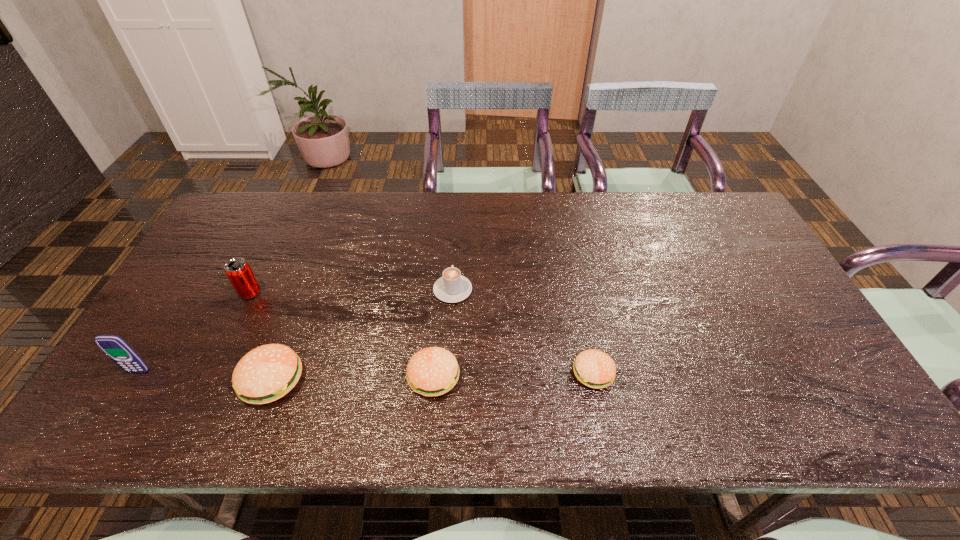
Locate an element on the screen. This screenshot has width=960, height=540. free region located 0.270m on the left of the second patty from right to left is located at coordinates (x=295, y=377).

Locate an element on the screen. The image size is (960, 540). vacant position located 0.400m on the back of the rightmost patty is located at coordinates (567, 248).

The image size is (960, 540). Find the location of `free space located 0.260m to the right of the cappuccino`. free space located 0.260m to the right of the cappuccino is located at coordinates (457, 220).

Locate an element on the screen. This screenshot has width=960, height=540. free space located to the right of the cappuccino is located at coordinates (457, 224).

You are a GUI agent. You are given a task and a screenshot of the screen. Output one action in this format:
    pyautogui.click(x=<x>, y=<y>)
    Task: Click on the vacant space situated 0.360m to the right of the cappuccino
    
    Given the screenshot: What is the action you would take?
    pyautogui.click(x=458, y=202)

Identify the location of vacant space located 0.280m on the front of the second tallest object. (203, 392).

At what (x,y) coordinates should I click in order to perform the action: click on vacant space located 0.050m on the front-facing side of the cellular telephone. Please return your answer as a coordinate pair (x, y). The width and height of the screenshot is (960, 540). Looking at the image, I should click on (126, 393).

This screenshot has width=960, height=540. In order to click on cellular telephone that is at the near edge in this screenshot , I will do `click(114, 347)`.

Identify the location of object situated at the left edge. This screenshot has width=960, height=540. [x=114, y=347].

Identify the location of object that is at the near left corner. The height and width of the screenshot is (540, 960). (114, 347).